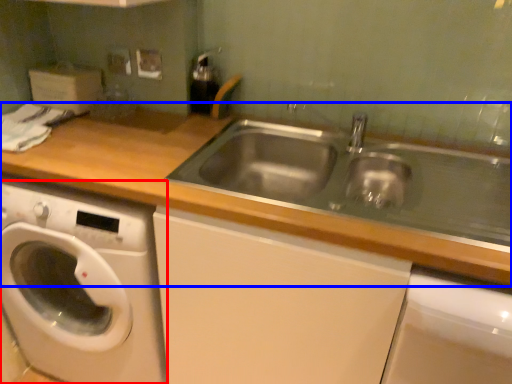
Question: Which object is closer to the camera taking this photo, washing machine (highlighted by a red box) or countertop (highlighted by a blue box)?

Choices:
 (A) washing machine
 (B) countertop

Answer: (B)